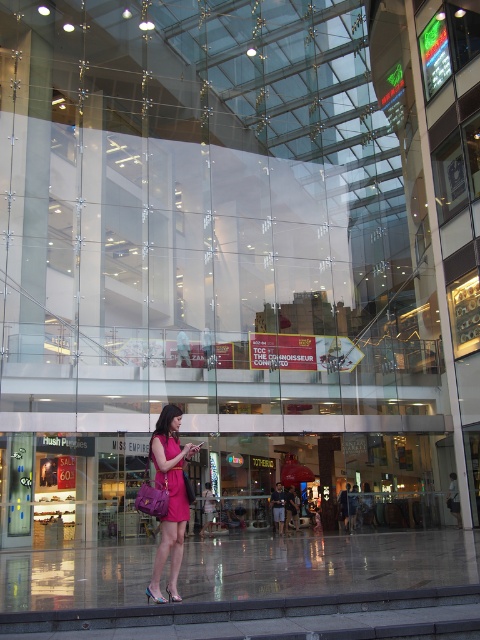
Please look at the image of the mall. There is a point at coordinates (169, 497). Is there a pink fabric dress at center near that point?

The pink fabric dress at center is located at point (169, 497), so yes, the pink fabric dress at center is near that point.

A woman in a pink fabric dress at center is standing outside a shopping mall. She wants to enter the mall through the entrance that is closest to her. The entrance is located 6.38 meters away from her current position. If she walks at a speed of 1.5 meters per second, how many seconds will it take her to reach the entrance?

The entrance is 6.38 meters away from the pink fabric dress at center. At a walking speed of 1.5 meters per second, it will take her approximately 4.25 seconds to reach the entrance. This is calculated by dividing the distance by the speed.